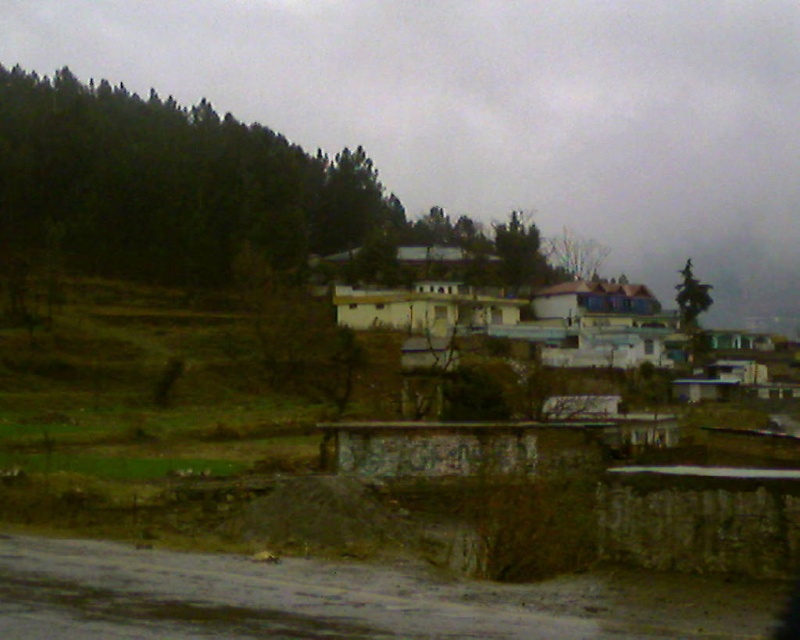
Does point (505, 252) lie in front of point (676, 298)?

No, (505, 252) is behind (676, 298).

Can you confirm if green matte tree at upper center is positioned to the left of green leafy tree at upper right?

Yes, green matte tree at upper center is to the left of green leafy tree at upper right.

Between point (546, 266) and point (680, 326), which one is positioned behind?

Positioned behind is point (546, 266).

Identify the location of green matte tree at upper center. (520, 252).

Looking at this image, does green leafy trees at left have a greater height compared to green matte tree at upper center?

Yes, green leafy trees at left is taller than green matte tree at upper center.

Image resolution: width=800 pixels, height=640 pixels. What are the coordinates of `green leafy trees at left` in the screenshot? It's located at (169, 182).

Can you confirm if green leafy trees at left is smaller than green leafy tree at upper right?

No.

Does point (16, 240) come farther from viewer compared to point (686, 285)?

No, it is not.

Locate an element on the screen. green leafy trees at left is located at coordinates [x=169, y=182].